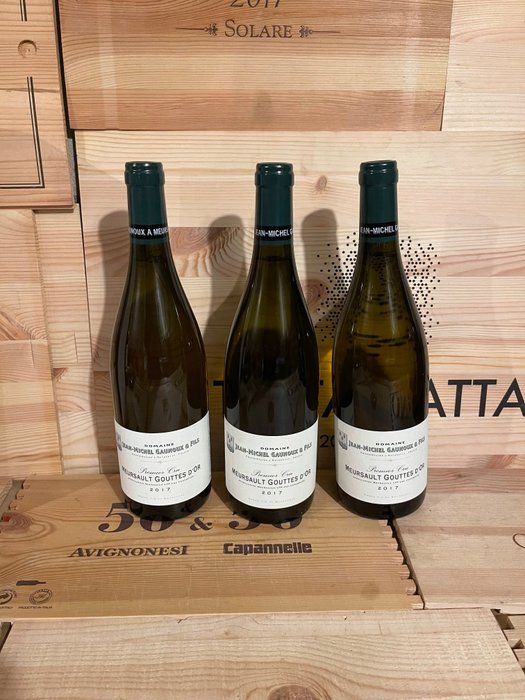
This screenshot has height=700, width=525. Identify the location of wooden crates used as table. (238, 586), (480, 568), (430, 650).